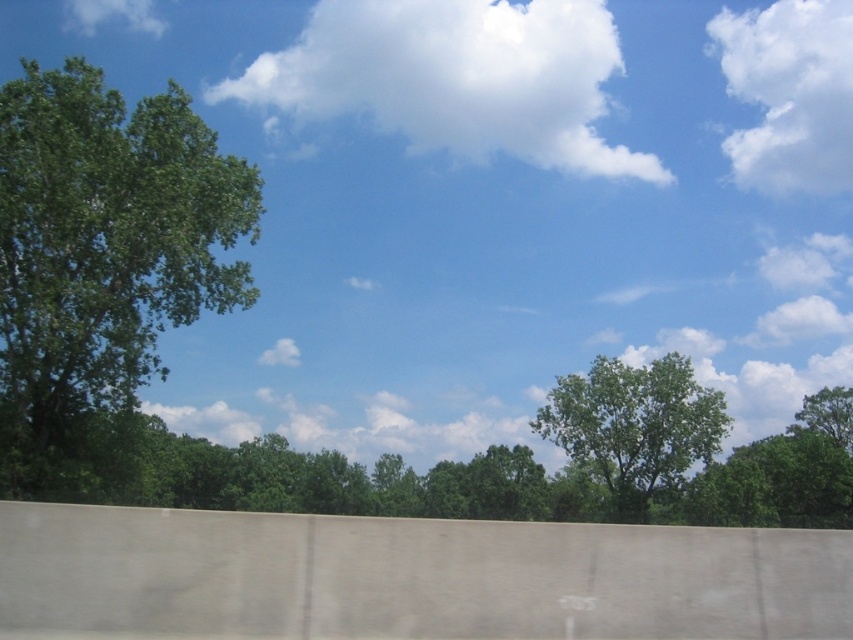
You are an artist sketching the scene and want to ensure proper proportions. Given the white fluffy cloud at upper center and the green leafy tree at center, which object should you draw first to maintain perspective?

You should draw the white fluffy cloud at upper center first because it is larger in size compared to the green leafy tree at center, indicating it is closer to the viewer and should be placed in the foreground for proper perspective.

You are a photographer trying to capture the white fluffy cloud at upper right and the green leafy tree at right in a single shot. Based on their sizes in the image, which object would appear bigger in your photo?

The white fluffy cloud at upper right appears bigger in the photo because it has a larger size compared to the green leafy tree at right.